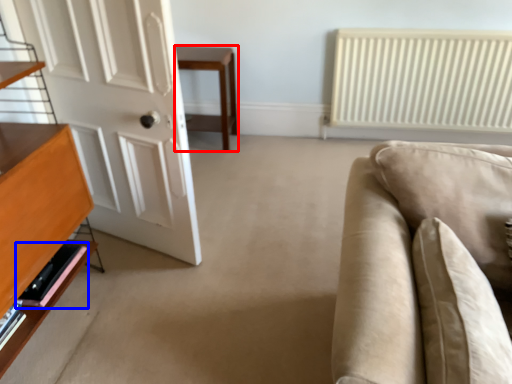
Question: Which of the following is the farthest to the observer, table (highlighted by a red box) or shelf (highlighted by a blue box)?

Choices:
 (A) table
 (B) shelf

Answer: (A)